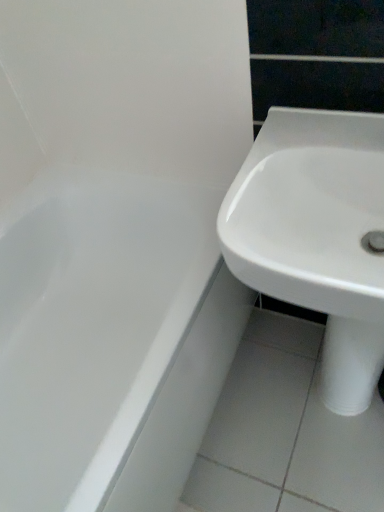
Find the location of a particular element. white glossy sink at right is located at coordinates (316, 236).

This screenshot has height=512, width=384. Describe the element at coordinates (316, 236) in the screenshot. I see `white glossy sink at right` at that location.

Where is `white glossy bathtub at left`? Image resolution: width=384 pixels, height=512 pixels. white glossy bathtub at left is located at coordinates 110,340.

Describe the element at coordinates (110, 340) in the screenshot. I see `white glossy bathtub at left` at that location.

What is the approximate width of white glossy bathtub at left?

white glossy bathtub at left is 74.02 centimeters wide.

Measure the distance between white glossy bathtub at left and camera.

white glossy bathtub at left and camera are 27.49 inches apart.

The height and width of the screenshot is (512, 384). What are the coordinates of `white glossy sink at right` in the screenshot? It's located at (316, 236).

Between white glossy bathtub at left and white glossy sink at right, which one appears on the right side from the viewer's perspective?

Positioned to the right is white glossy sink at right.

Considering their positions, is white glossy bathtub at left located in front of or behind white glossy sink at right?

Clearly, white glossy bathtub at left is behind white glossy sink at right.

Does point (113, 421) come behind point (262, 140)?

Yes, it is.

From the image's perspective, is white glossy bathtub at left located above or below white glossy sink at right?

white glossy bathtub at left is situated lower than white glossy sink at right in the image.

From a real-world perspective, between white glossy bathtub at left and white glossy sink at right, who is vertically lower?

white glossy bathtub at left, from a real-world perspective.

Looking at this image, considering the sizes of objects white glossy bathtub at left and white glossy sink at right in the image provided, who is wider, white glossy bathtub at left or white glossy sink at right?

With larger width is white glossy bathtub at left.

Between white glossy bathtub at left and white glossy sink at right, which one has less height?

white glossy sink at right is shorter.

Who is smaller, white glossy bathtub at left or white glossy sink at right?

white glossy sink at right is smaller.

Is white glossy sink at right completely or partially inside white glossy bathtub at left?

That's incorrect, white glossy sink at right is not inside white glossy bathtub at left.

Is white glossy bathtub at left beside white glossy sink at right?

There is a gap between white glossy bathtub at left and white glossy sink at right.

Is white glossy sink at right at the back of white glossy bathtub at left?

white glossy bathtub at left does not have its back to white glossy sink at right.

Locate an element on the screen. This screenshot has width=384, height=512. sink in front of the white glossy bathtub at left is located at coordinates (316, 236).

Is white glossy sink at right to the right of white glossy bathtub at left from the viewer's perspective?

Indeed, white glossy sink at right is positioned on the right side of white glossy bathtub at left.

Relative to white glossy bathtub at left, is white glossy sink at right in front or behind?

white glossy sink at right is positioned closer to the viewer than white glossy bathtub at left.

Is point (330, 370) more distant than point (178, 388)?

Yes, point (330, 370) is farther from viewer.

From the image's perspective, which one is positioned higher, white glossy sink at right or white glossy bathtub at left?

white glossy sink at right, from the image's perspective.

From a real-world perspective, which object rests below the other?

white glossy bathtub at left.

Looking at their sizes, would you say white glossy sink at right is wider or thinner than white glossy bathtub at left?

Clearly, white glossy sink at right has less width compared to white glossy bathtub at left.

Based on the photo, which of these two, white glossy sink at right or white glossy bathtub at left, stands shorter?

white glossy sink at right.

Is white glossy sink at right bigger or smaller than white glossy bathtub at left?

In the image, white glossy sink at right appears to be smaller than white glossy bathtub at left.

Can we say white glossy sink at right lies outside white glossy bathtub at left?

Yes, white glossy sink at right is located beyond the bounds of white glossy bathtub at left.

In the scene shown: Is white glossy sink at right not close to white glossy bathtub at left?

No.

Is white glossy sink at right oriented towards white glossy bathtub at left?

No, white glossy sink at right does not turn towards white glossy bathtub at left.

Locate an element on the screen. Image resolution: width=384 pixels, height=512 pixels. sink above the white glossy bathtub at left (from the image's perspective) is located at coordinates (316, 236).

Where is `bathtub beneath the white glossy sink at right (from a real-world perspective)`? This screenshot has width=384, height=512. bathtub beneath the white glossy sink at right (from a real-world perspective) is located at coordinates (110, 340).

Locate an element on the screen. Image resolution: width=384 pixels, height=512 pixels. sink on the right of white glossy bathtub at left is located at coordinates (316, 236).